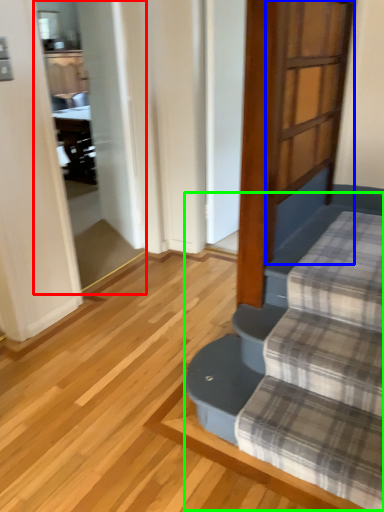
Question: Which object is the closest to the screen door (highlighted by a red box)? Choose among these: screen door (highlighted by a blue box) or stairwell (highlighted by a green box).

Choices:
 (A) screen door
 (B) stairwell

Answer: (A)